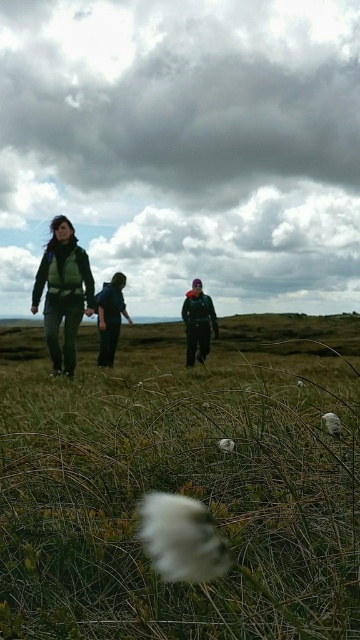
Who is more distant from viewer, (33, 285) or (189, 356)?

The point (189, 356) is behind.

Between matte green vest at left and dark green jacket at center, which one is positioned lower?

dark green jacket at center

Image resolution: width=360 pixels, height=640 pixels. I want to click on matte green vest at left, so click(62, 291).

What do you see at coordinates (62, 291) in the screenshot? I see `matte green vest at left` at bounding box center [62, 291].

Based on the photo, is matte green vest at left below dark green fabric jacket at center?

Incorrect, matte green vest at left is not positioned below dark green fabric jacket at center.

Which is behind, point (52, 278) or point (108, 352)?

The point (108, 352) is more distant.

You are a GUI agent. You are given a task and a screenshot of the screen. Output one action in this format:
    pyautogui.click(x=<x>, y=<y>)
    Task: Click on the matte green vest at left
    This screenshot has width=360, height=640.
    Given the screenshot: What is the action you would take?
    pyautogui.click(x=62, y=291)

Which of these two, white fluffy cotton at center or dark green jacket at center, stands shorter?

With less height is white fluffy cotton at center.

You are a GUI agent. You are given a task and a screenshot of the screen. Output one action in this format:
    pyautogui.click(x=<x>, y=<y>)
    Task: Click on the white fluffy cotton at center
    Image resolution: width=360 pixels, height=640 pixels.
    Given the screenshot: What is the action you would take?
    pyautogui.click(x=181, y=538)

The height and width of the screenshot is (640, 360). What are the coordinates of `white fluffy cotton at center` in the screenshot? It's located at 181,538.